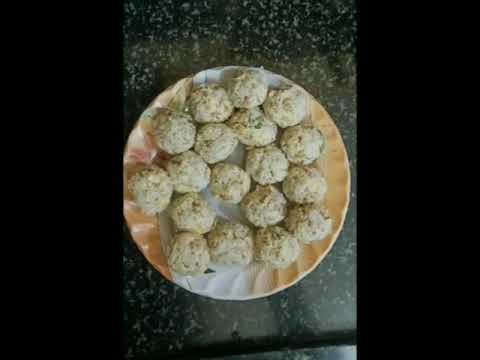
Where is `green granite counter`? The width and height of the screenshot is (480, 360). green granite counter is located at coordinates (212, 29).